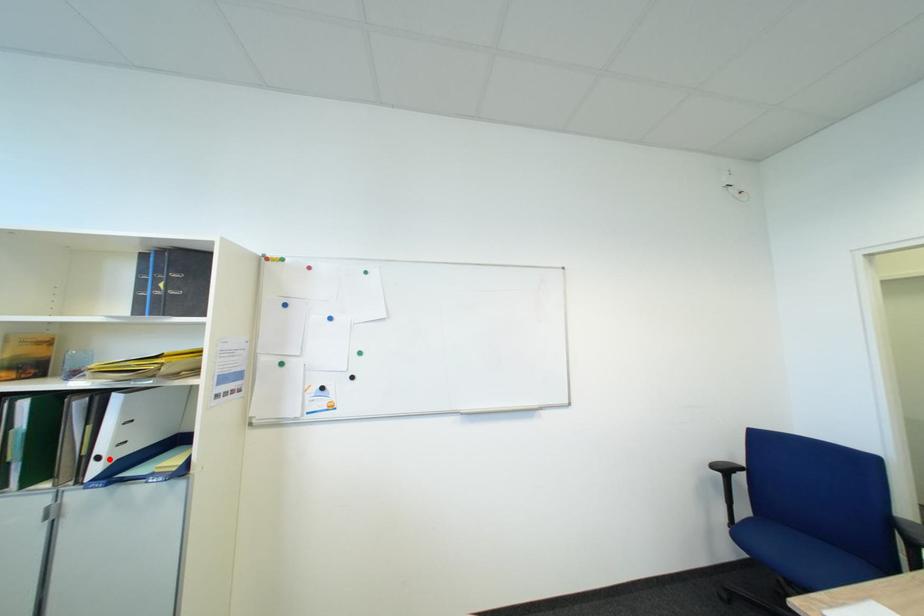
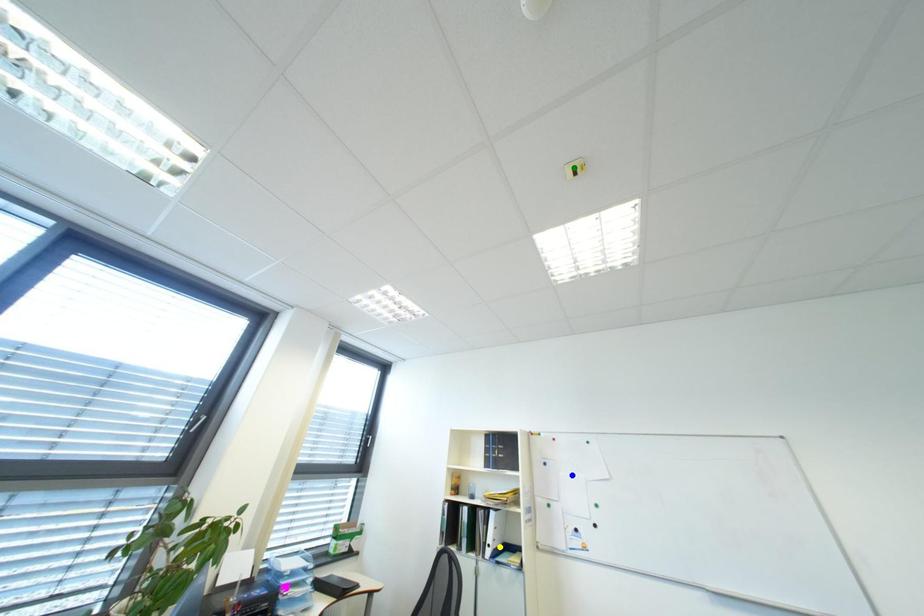
Question: I am providing you with two images of the same scene from different viewpoints. A red point is marked on the first image. You are given multiple points on the second image. Which point in image 2 represents the same 3d spot as the red point in image 1?

Choices:
 (A) blue point
 (B) green point
 (C) yellow point

Answer: (C)